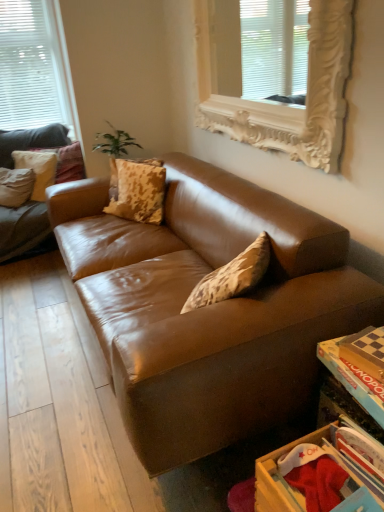
Question: Does white ornate frame at upper center, arranged as the 2th window when viewed from the left, lie behind wooden drawer at lower right?

Choices:
 (A) no
 (B) yes

Answer: (B)

Question: Is white ornate frame at upper center, which is counted as the 1th window, starting from the right, facing away from wooden drawer at lower right?

Choices:
 (A) no
 (B) yes

Answer: (A)

Question: Can you confirm if white ornate frame at upper center, arranged as the 2th window when viewed from the left, is positioned to the right of wooden drawer at lower right?

Choices:
 (A) yes
 (B) no

Answer: (B)

Question: From a real-world perspective, is white ornate frame at upper center, which appears as the 2th window when viewed from the back, positioned over wooden drawer at lower right based on gravity?

Choices:
 (A) yes
 (B) no

Answer: (A)

Question: Could you tell me if white ornate frame at upper center, arranged as the 2th window when viewed from the left, is facing wooden drawer at lower right?

Choices:
 (A) yes
 (B) no

Answer: (B)

Question: Is white matte window at upper left, positioned as the first window in back-to-front order, taller or shorter than matte beige pillow at upper left, the 1th pillow when ordered from back to front?

Choices:
 (A) tall
 (B) short

Answer: (A)

Question: From a real-world perspective, is white matte window at upper left, which appears as the first window when viewed from the left, positioned above or below matte beige pillow at upper left, arranged as the 2th pillow when viewed from the right?

Choices:
 (A) below
 (B) above

Answer: (B)

Question: Does point (31, 25) appear closer or farther from the camera than point (69, 168)?

Choices:
 (A) farther
 (B) closer

Answer: (A)

Question: Would you say white matte window at upper left, which appears as the first window when viewed from the left, is inside or outside matte beige pillow at upper left, the 1th pillow when ordered from back to front?

Choices:
 (A) inside
 (B) outside

Answer: (B)

Question: Is camouflage-patterned pillow at center, the 1th pillow positioned from the front, in front of or behind white matte window at upper left, which appears as the 2th window when viewed from the front, in the image?

Choices:
 (A) front
 (B) behind

Answer: (A)

Question: Choose the correct answer: Is camouflage-patterned pillow at center, the 1th pillow positioned from the front, inside white matte window at upper left, which appears as the 2th window when viewed from the front, or outside it?

Choices:
 (A) outside
 (B) inside

Answer: (A)

Question: Is point (135, 198) closer or farther from the camera than point (54, 113)?

Choices:
 (A) farther
 (B) closer

Answer: (B)

Question: From the image's perspective, is camouflage-patterned pillow at center, the 3th pillow from the left, positioned above or below white matte window at upper left, which appears as the 2th window when viewed from the front?

Choices:
 (A) above
 (B) below

Answer: (B)

Question: Would you say brown leather couch at left is to the left or to the right of white matte window at upper left, marked as the 2th window in a right-to-left arrangement, in the picture?

Choices:
 (A) left
 (B) right

Answer: (B)

Question: Considering the positions of brown leather couch at left and white matte window at upper left, which appears as the 2th window when viewed from the front, in the image, is brown leather couch at left bigger or smaller than white matte window at upper left, which appears as the 2th window when viewed from the front,?

Choices:
 (A) big
 (B) small

Answer: (A)